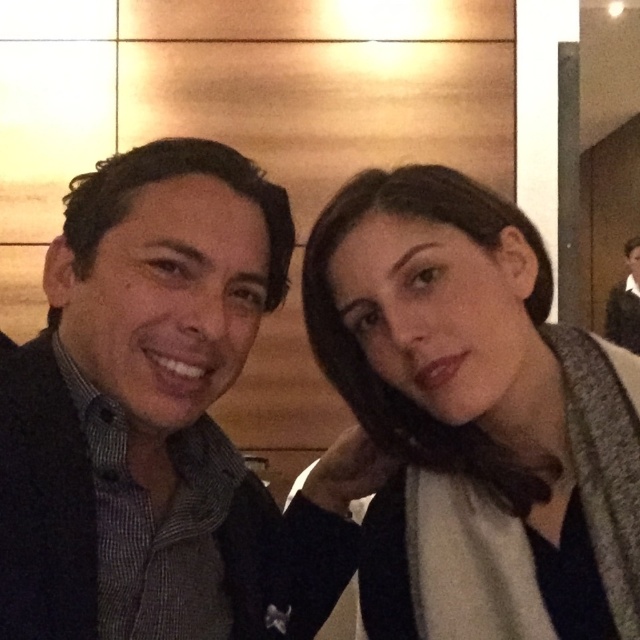
Is point (625, 416) more distant than point (212, 467)?

No.

Which of these two, matte gray scarf at center or matte black jacket at left, stands taller?

With more height is matte black jacket at left.

Who is more forward, [589,349] or [198,416]?

Point [589,349] is more forward.

Locate an element on the screen. The width and height of the screenshot is (640, 640). matte gray scarf at center is located at coordinates (476, 417).

Is matte black jacket at left shorter than dark brown leather jacket at upper right?

Correct, matte black jacket at left is not as tall as dark brown leather jacket at upper right.

Is matte black jacket at left to the right of dark brown leather jacket at upper right from the viewer's perspective?

No, matte black jacket at left is not to the right of dark brown leather jacket at upper right.

Image resolution: width=640 pixels, height=640 pixels. Describe the element at coordinates (145, 408) in the screenshot. I see `matte black jacket at left` at that location.

I want to click on matte black jacket at left, so click(145, 408).

Who is positioned more to the left, matte gray scarf at center or dark brown leather jacket at upper right?

Positioned to the left is matte gray scarf at center.

Does point (369, 552) lie in front of point (628, 333)?

Yes, point (369, 552) is in front of point (628, 333).

This screenshot has height=640, width=640. Find the location of `matte gray scarf at center`. matte gray scarf at center is located at coordinates pyautogui.click(x=476, y=417).